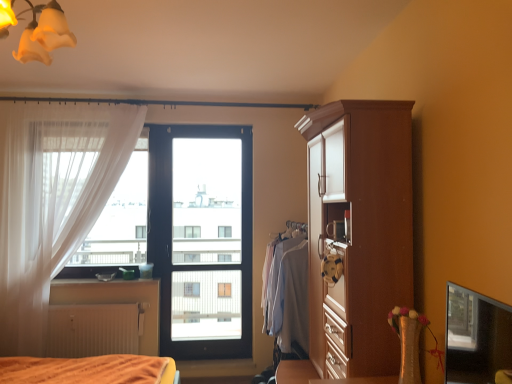
Question: Is point (30, 39) closer or farther from the camera than point (93, 336)?

Choices:
 (A) farther
 (B) closer

Answer: (B)

Question: Is yellow frosted glass light fixture at upper left to the left or to the right of white matte radiator at lower left in the image?

Choices:
 (A) right
 (B) left

Answer: (A)

Question: Which object is the closest to the matte black window sill at lower left?

Choices:
 (A) white matte radiator at lower left
 (B) yellow frosted glass light fixture at upper left
 (C) transparent glass window screen at lower right
 (D) light blue fabric shirt at center
 (E) white sheer curtain at left

Answer: (A)

Question: Estimate the real-world distances between objects in this image. Which object is farther from the matte black window sill at lower left?

Choices:
 (A) yellow frosted glass light fixture at upper left
 (B) metallic silver toaster at upper center
 (C) transparent glass screen door at center
 (D) white matte radiator at lower left
 (E) light blue fabric shirt at center

Answer: (A)